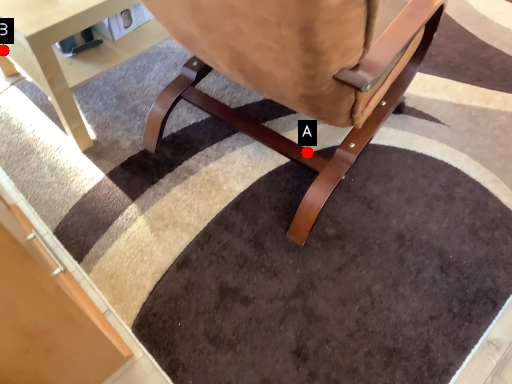
Question: Two points are circled on the image, labeled by A and B beside each circle. Which point is closer to the camera?

Choices:
 (A) A is closer
 (B) B is closer

Answer: (A)